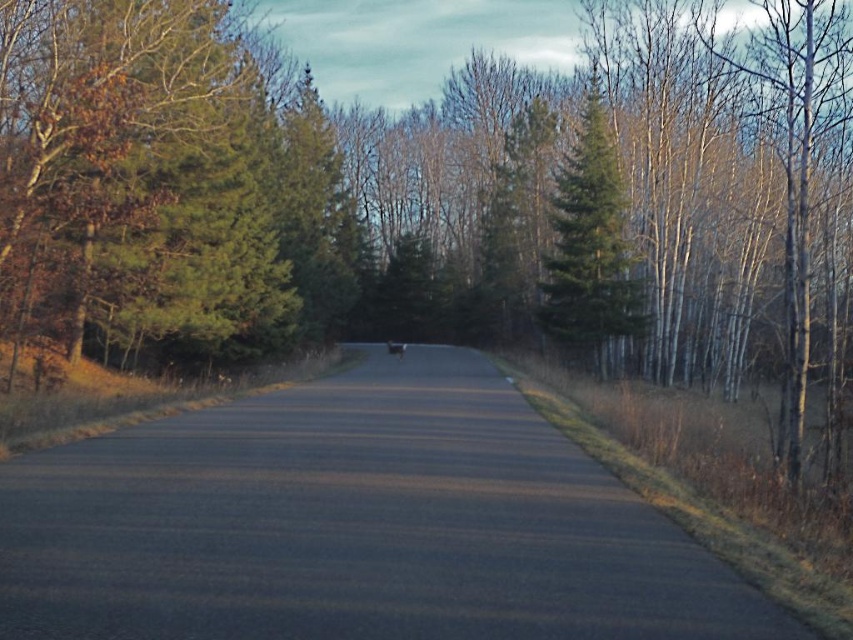
Question: Which point is closer to the camera?

Choices:
 (A) (381, 403)
 (B) (560, 272)

Answer: (A)

Question: Is asphalt road at center wider than green matte tree at center?

Choices:
 (A) yes
 (B) no

Answer: (A)

Question: Is asphalt road at center thinner than green matte tree at center?

Choices:
 (A) no
 (B) yes

Answer: (A)

Question: Which point appears farthest from the camera in this image?

Choices:
 (A) click(x=238, y=500)
 (B) click(x=560, y=234)

Answer: (B)

Question: Is asphalt road at center thinner than green matte tree at center?

Choices:
 (A) no
 (B) yes

Answer: (A)